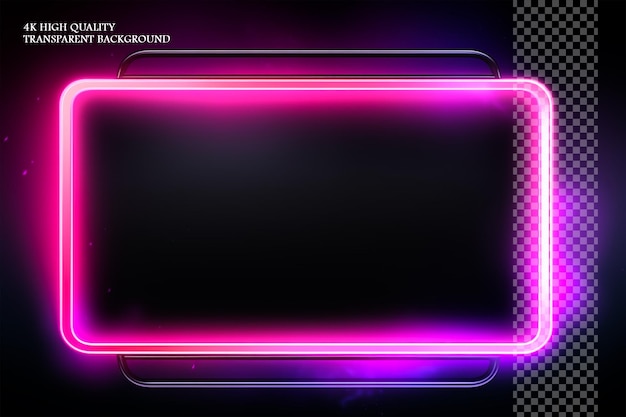
Locate an element on the screen. The image size is (626, 417). purple light is located at coordinates (225, 34), (196, 366).